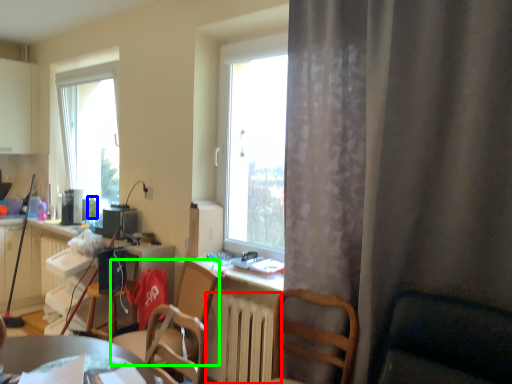
Question: Based on their relative distances, which object is farther from radiator (highlighted by a red box)? Choose from bottle (highlighted by a blue box) and chair (highlighted by a green box).

Choices:
 (A) bottle
 (B) chair

Answer: (A)